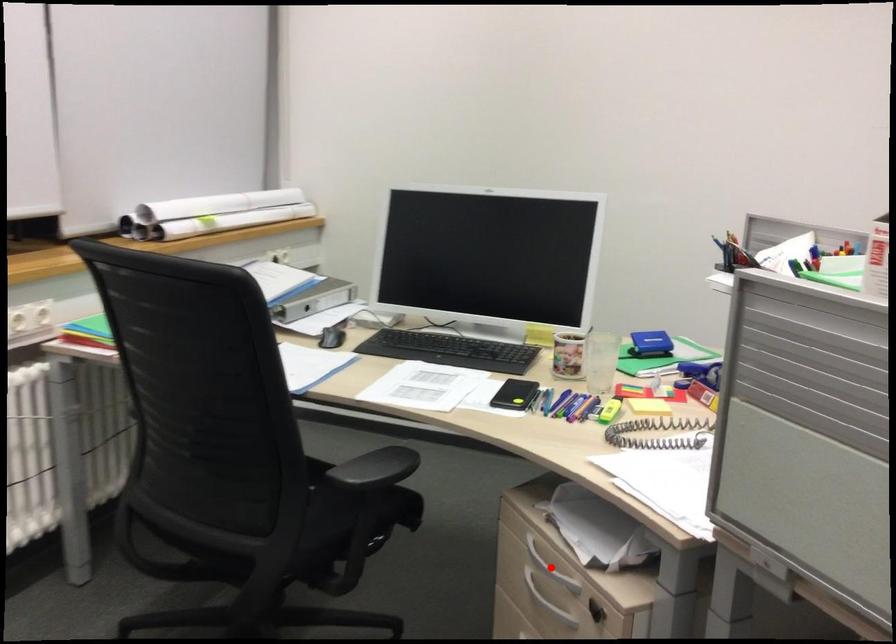
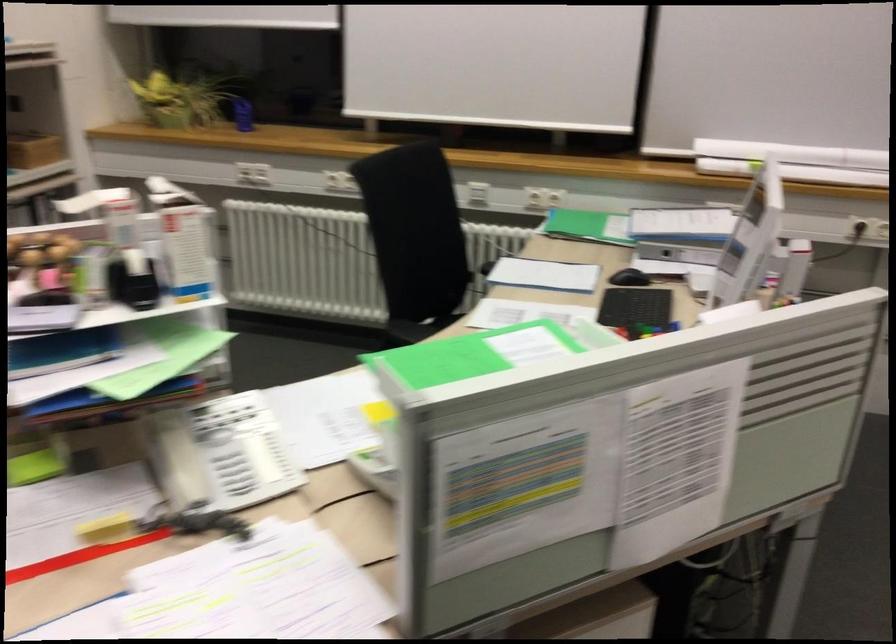
Question: I am providing you with two images of the same scene from different viewpoints. A red point is marked on the first image. Can you still see the location of the red point in image 2?

Choices:
 (A) Yes
 (B) No

Answer: (B)